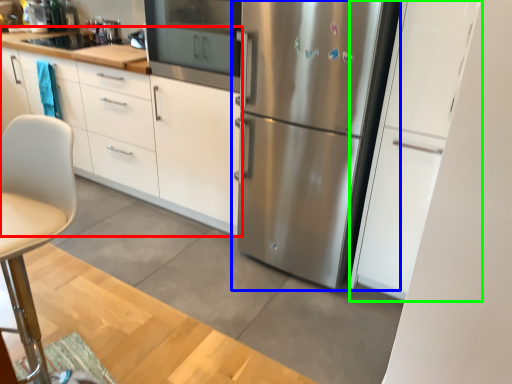
Question: Estimate the real-world distances between objects in this image. Which object is farther from cabinetry (highlighted by a red box), refrigerator (highlighted by a blue box) or cabinetry (highlighted by a green box)?

Choices:
 (A) refrigerator
 (B) cabinetry

Answer: (B)